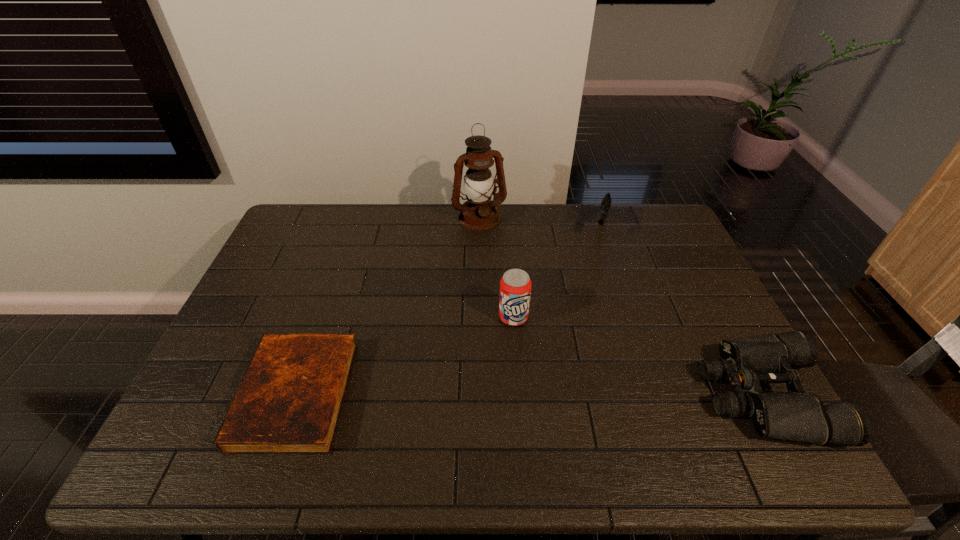
The height and width of the screenshot is (540, 960). I want to click on the leftmost object, so click(289, 401).

At what (x,y) coordinates should I click in order to perform the action: click on the shortest object. Please return your answer as a coordinate pair (x, y). The width and height of the screenshot is (960, 540). Looking at the image, I should click on pyautogui.click(x=289, y=401).

The height and width of the screenshot is (540, 960). Find the location of `binoculars`. binoculars is located at coordinates (796, 415).

I want to click on the fourth tallest object, so click(x=796, y=415).

Locate an element on the screen. The height and width of the screenshot is (540, 960). the fourth shortest object is located at coordinates (515, 286).

At what (x,y) coordinates should I click in order to perform the action: click on soda can. Please return your answer as a coordinate pair (x, y). The height and width of the screenshot is (540, 960). Looking at the image, I should click on (515, 286).

I want to click on the tallest object, so click(x=480, y=213).

Where is `gun`? The width and height of the screenshot is (960, 540). gun is located at coordinates (606, 202).

Where is `the fourth object from left to right`? the fourth object from left to right is located at coordinates (606, 202).

Locate an element on the screen. The height and width of the screenshot is (540, 960). vacant space situated on the spine side of the leftmost object is located at coordinates (202, 395).